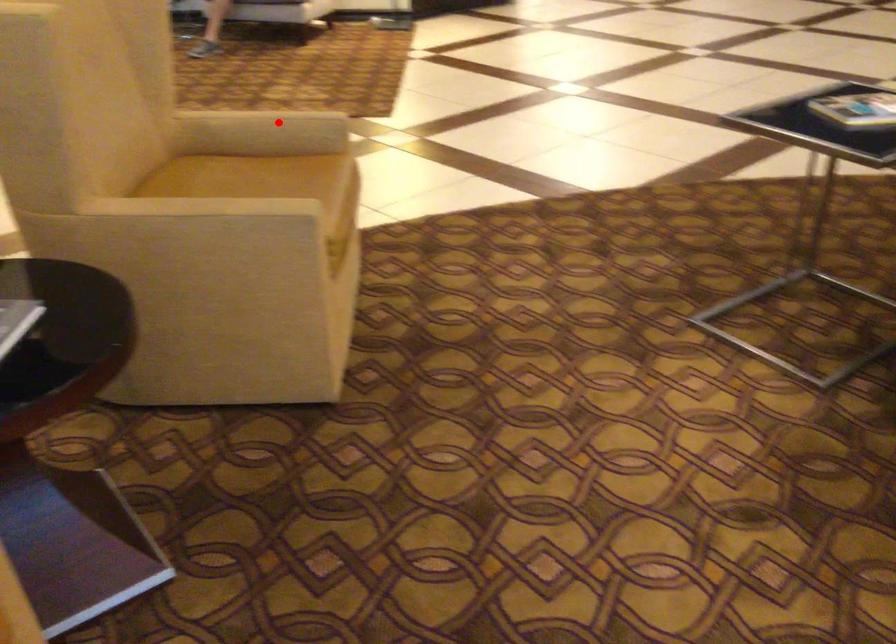
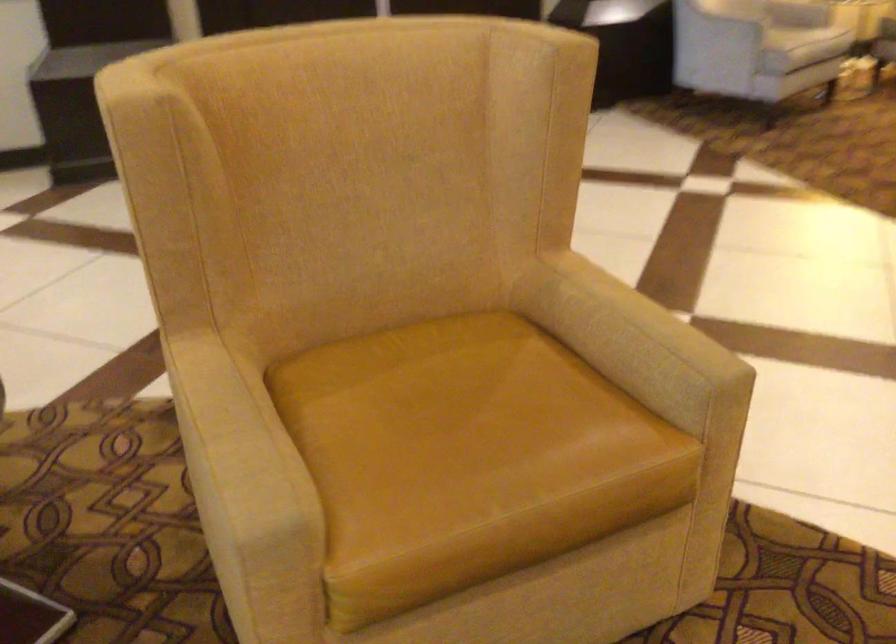
Where in the second image is the point corresponding to the highlighted location from the first image?

(624, 322)